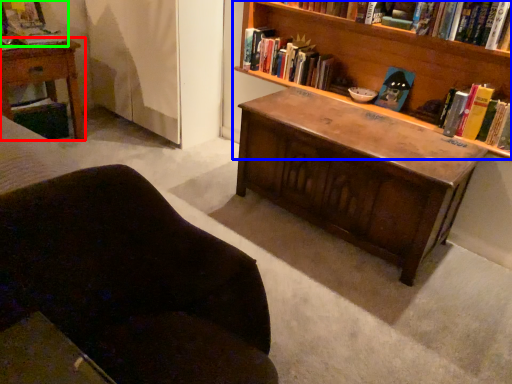
Question: Which object is positioned closest to nightstand (highlighted by a red box)? Select from bookcase (highlighted by a blue box) and book (highlighted by a green box).

Choices:
 (A) bookcase
 (B) book

Answer: (B)